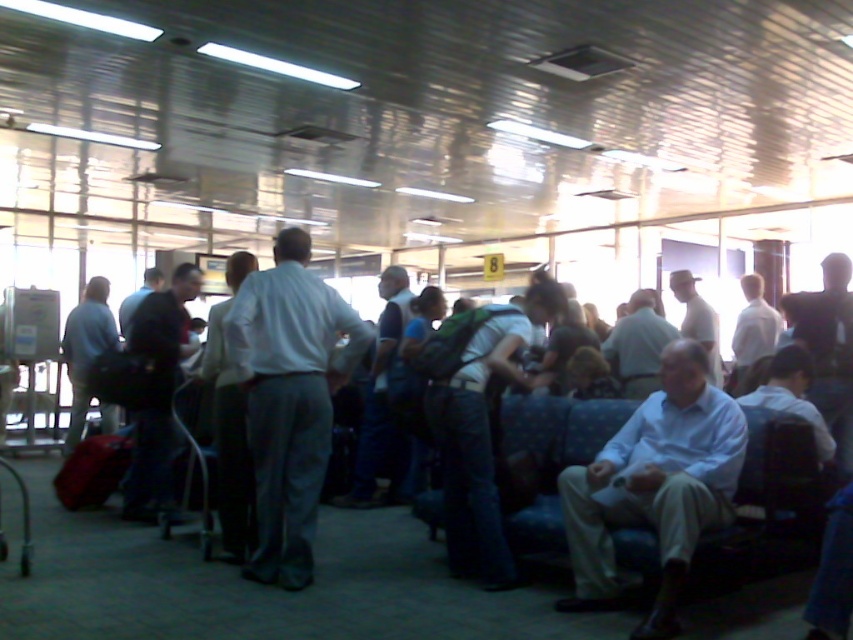
Which of these two, white shirt at center or light blue shirt at center, stands shorter?

With less height is white shirt at center.

Based on the photo, who is higher up, white shirt at center or light blue shirt at center?

light blue shirt at center

Image resolution: width=853 pixels, height=640 pixels. What do you see at coordinates (654, 486) in the screenshot?
I see `white shirt at center` at bounding box center [654, 486].

Find the location of a particular element. This screenshot has width=853, height=640. white shirt at center is located at coordinates (654, 486).